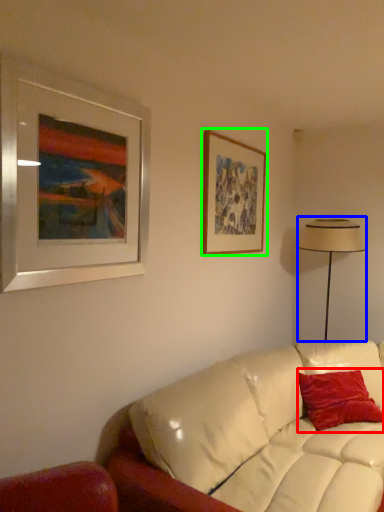
Question: Estimate the real-world distances between objects in this image. Which object is closer to pillow (highlighted by a red box), table lamp (highlighted by a blue box) or picture frame (highlighted by a green box)?

Choices:
 (A) table lamp
 (B) picture frame

Answer: (A)